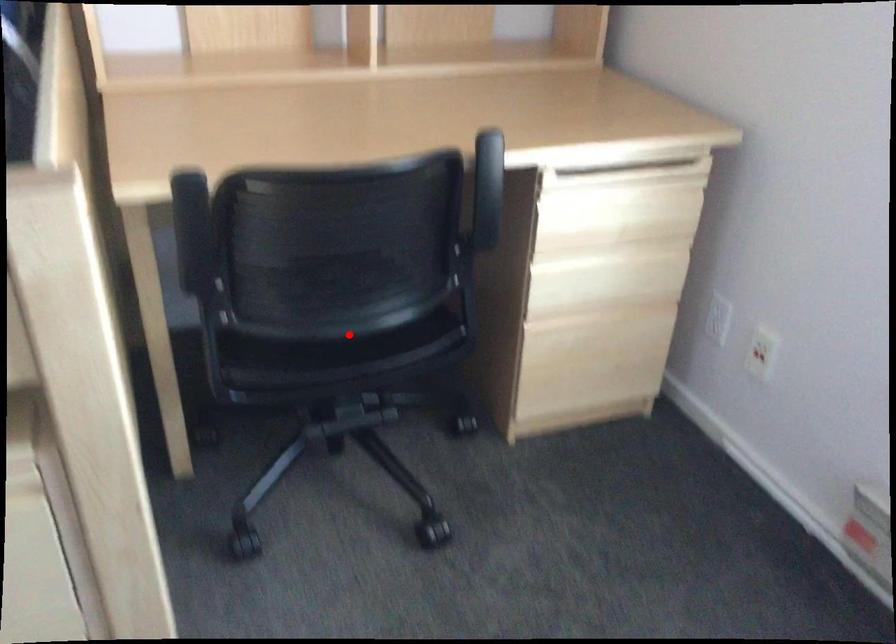
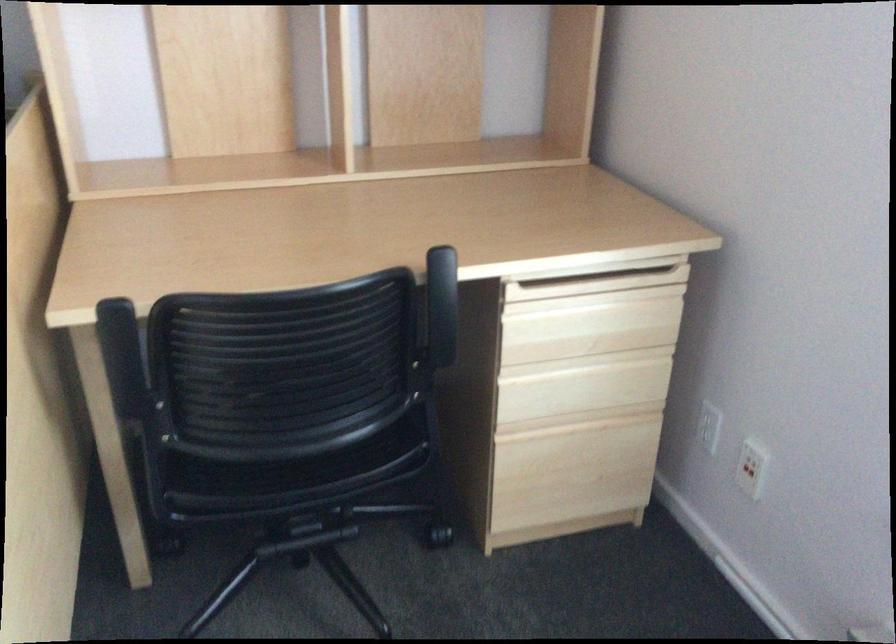
The point at the highlighted location is marked in the first image. Where is the corresponding point in the second image?

(296, 455)